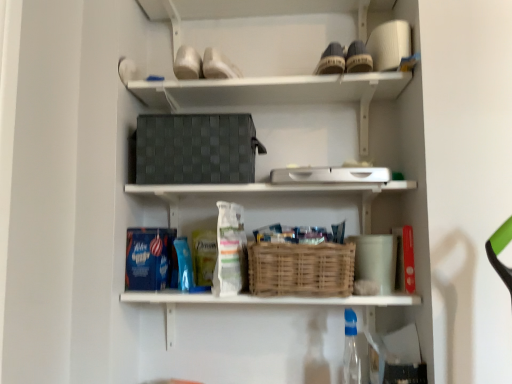
How much space does woven wicker basket at center, which is the second shelf in top-to-bottom order, occupy vertically?

20.25 centimeters.

What do you see at coordinates (351, 350) in the screenshot?
I see `transparent plastic bottle at lower center` at bounding box center [351, 350].

The width and height of the screenshot is (512, 384). What do you see at coordinates (331, 60) in the screenshot? I see `matte brown shoe at upper center` at bounding box center [331, 60].

Identify the location of woven wicker basket at center, the 1th shelf from the bottom. (268, 195).

The width and height of the screenshot is (512, 384). Find the location of `shelf located on the right of woven wicker basket at center, the 1th shelf from the bottom`. shelf located on the right of woven wicker basket at center, the 1th shelf from the bottom is located at coordinates (275, 93).

Is woven wicker basket at center, which is the second shelf in top-to-bottom order, far from dark gray woven basket at upper center, which is the second shelf from bottom to top?

No, woven wicker basket at center, which is the second shelf in top-to-bottom order, is not far away from dark gray woven basket at upper center, which is the second shelf from bottom to top.

Does woven wicker basket at center, the 1th shelf from the bottom, have a greater width compared to dark gray woven basket at upper center, the first shelf viewed from the top?

No, woven wicker basket at center, the 1th shelf from the bottom, is not wider than dark gray woven basket at upper center, the first shelf viewed from the top.

Is point (176, 221) closer or farther from the camera than point (356, 323)?

Point (176, 221) is positioned farther from the camera compared to point (356, 323).

From the image's perspective, which one is positioned lower, woven wicker basket at center, the 1th shelf from the bottom, or transparent plastic bottle at lower center?

transparent plastic bottle at lower center, from the image's perspective.

Is woven wicker basket at center, the 1th shelf from the bottom, wider or thinner than transparent plastic bottle at lower center?

woven wicker basket at center, the 1th shelf from the bottom, is wider than transparent plastic bottle at lower center.

How many degrees apart are the facing directions of woven wicker basket at center, the 1th shelf from the bottom, and transparent plastic bottle at lower center?

The facing directions of woven wicker basket at center, the 1th shelf from the bottom, and transparent plastic bottle at lower center are 2.26 degrees apart.

From the image's perspective, does dark gray woven basket at upper center, which is the second shelf from bottom to top, appear lower than woven wicker basket at center, the 1th shelf from the bottom?

Actually, dark gray woven basket at upper center, which is the second shelf from bottom to top, appears above woven wicker basket at center, the 1th shelf from the bottom, in the image.

From a real-world perspective, does dark gray woven basket at upper center, which is the second shelf from bottom to top, stand above woven wicker basket at center, which is the second shelf in top-to-bottom order?

Yes, from a real-world perspective, dark gray woven basket at upper center, which is the second shelf from bottom to top, is above woven wicker basket at center, which is the second shelf in top-to-bottom order.

Would you say dark gray woven basket at upper center, the first shelf viewed from the top, is inside or outside woven wicker basket at center, which is the second shelf in top-to-bottom order?

The correct answer is: outside.

Which point is more forward, (276,86) or (161,300)?

Point (161,300)

Between bamboo basket at center and transparent plastic bottle at lower center, which one appears on the right side from the viewer's perspective?

From the viewer's perspective, transparent plastic bottle at lower center appears more on the right side.

Can you confirm if bamboo basket at center is taller than transparent plastic bottle at lower center?

No, bamboo basket at center is not taller than transparent plastic bottle at lower center.

From the picture: Is the position of bamboo basket at center less distant than that of transparent plastic bottle at lower center?

Yes, bamboo basket at center is in front of transparent plastic bottle at lower center.

From the image's perspective, is matte brown shoe at upper center on top of transparent plastic bottle at lower center?

Yes, from the image's perspective, matte brown shoe at upper center is over transparent plastic bottle at lower center.

Is matte brown shoe at upper center positioned beyond the bounds of transparent plastic bottle at lower center?

Yes, matte brown shoe at upper center is located beyond the bounds of transparent plastic bottle at lower center.

Is matte brown shoe at upper center further to camera compared to transparent plastic bottle at lower center?

Yes, matte brown shoe at upper center is behind transparent plastic bottle at lower center.

Between transparent plastic bottle at lower center and matte brown shoe at upper center, which one has more height?

transparent plastic bottle at lower center is taller.

What's the angular difference between transparent plastic bottle at lower center and matte brown shoe at upper center's facing directions?

There is a 0.523-degree angle between the facing directions of transparent plastic bottle at lower center and matte brown shoe at upper center.

Is transparent plastic bottle at lower center inside the boundaries of matte brown shoe at upper center, or outside?

transparent plastic bottle at lower center is not inside matte brown shoe at upper center, it's outside.

I want to click on shoe above the transparent plastic bottle at lower center (from a real-world perspective), so click(331, 60).

From a real-world perspective, who is located higher, bamboo basket at center or dark gray woven basket at upper center, the first shelf viewed from the top?

From a 3D spatial view, dark gray woven basket at upper center, the first shelf viewed from the top, is above.

Is bamboo basket at center inside or outside of dark gray woven basket at upper center, the first shelf viewed from the top?

bamboo basket at center is located beyond the bounds of dark gray woven basket at upper center, the first shelf viewed from the top.

Can you confirm if bamboo basket at center is positioned to the left of dark gray woven basket at upper center, which is the second shelf from bottom to top?

No, bamboo basket at center is not to the left of dark gray woven basket at upper center, which is the second shelf from bottom to top.

From the image's perspective, is bamboo basket at center above or below dark gray woven basket at upper center, which is the second shelf from bottom to top?

Clearly, from the image's perspective, bamboo basket at center is below dark gray woven basket at upper center, which is the second shelf from bottom to top.

Locate an element on the screen. shelf below the dark gray woven basket at upper center, the first shelf viewed from the top (from the image's perspective) is located at coordinates (268, 195).

Locate an element on the screen. bottle lying in front of the woven wicker basket at center, the 1th shelf from the bottom is located at coordinates (351, 350).

Estimate the real-world distances between objects in this image. Which object is closer to woven wicker basket at center, the 1th shelf from the bottom, matte brown shoe at upper center or bamboo basket at center?

Among the two, bamboo basket at center is located nearer to woven wicker basket at center, the 1th shelf from the bottom.

Consider the image. Based on their spatial positions, is dark gray woven basket at upper center, which is the second shelf from bottom to top, or transparent plastic bottle at lower center closer to matte brown shoe at upper center?

The object closer to matte brown shoe at upper center is dark gray woven basket at upper center, which is the second shelf from bottom to top.

When comparing their distances from dark gray woven basket at upper center, which is the second shelf from bottom to top, does bamboo basket at center or matte brown shoe at upper center seem further?

bamboo basket at center is further to dark gray woven basket at upper center, which is the second shelf from bottom to top.

When comparing their distances from woven wicker basket at center, the 1th shelf from the bottom, does dark gray woven basket at upper center, which is the second shelf from bottom to top, or matte brown shoe at upper center seem further?

The object further to woven wicker basket at center, the 1th shelf from the bottom, is matte brown shoe at upper center.

Which object lies nearer to the anchor point transparent plastic bottle at lower center, matte brown shoe at upper center or bamboo basket at center?

Result: Based on the image, bamboo basket at center appears to be nearer to transparent plastic bottle at lower center.

Considering their positions, is matte brown shoe at upper center positioned closer to dark gray woven basket at upper center, the first shelf viewed from the top, than woven wicker basket at center, the 1th shelf from the bottom?

woven wicker basket at center, the 1th shelf from the bottom, is closer to dark gray woven basket at upper center, the first shelf viewed from the top.

Consider the image. From the image, which object appears to be farther from woven wicker basket at center, the 1th shelf from the bottom, matte brown shoe at upper center or transparent plastic bottle at lower center?

The object further to woven wicker basket at center, the 1th shelf from the bottom, is matte brown shoe at upper center.

Considering their positions, is dark gray woven basket at upper center, the first shelf viewed from the top, positioned closer to woven wicker basket at center, the 1th shelf from the bottom, than transparent plastic bottle at lower center?

Based on the image, dark gray woven basket at upper center, the first shelf viewed from the top, appears to be nearer to woven wicker basket at center, the 1th shelf from the bottom.

At what (x,y) coordinates should I click in order to perform the action: click on shelf that lies between dark gray woven basket at upper center, which is the second shelf from bottom to top, and bamboo basket at center from top to bottom. Please return your answer as a coordinate pair (x, y). The width and height of the screenshot is (512, 384). Looking at the image, I should click on (268, 195).

This screenshot has width=512, height=384. I want to click on shelf between dark gray woven basket at upper center, the first shelf viewed from the top, and transparent plastic bottle at lower center in the up-down direction, so click(x=268, y=195).

Identify the location of basket between dark gray woven basket at upper center, the first shelf viewed from the top, and transparent plastic bottle at lower center, in the vertical direction. (301, 269).

Locate an element on the screen. basket between woven wicker basket at center, which is the second shelf in top-to-bottom order, and transparent plastic bottle at lower center from top to bottom is located at coordinates (301, 269).